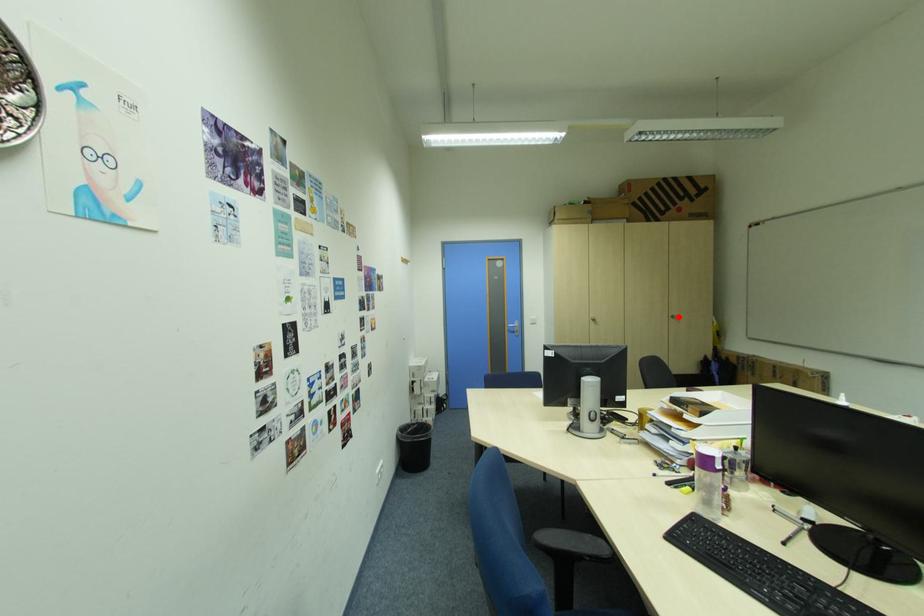
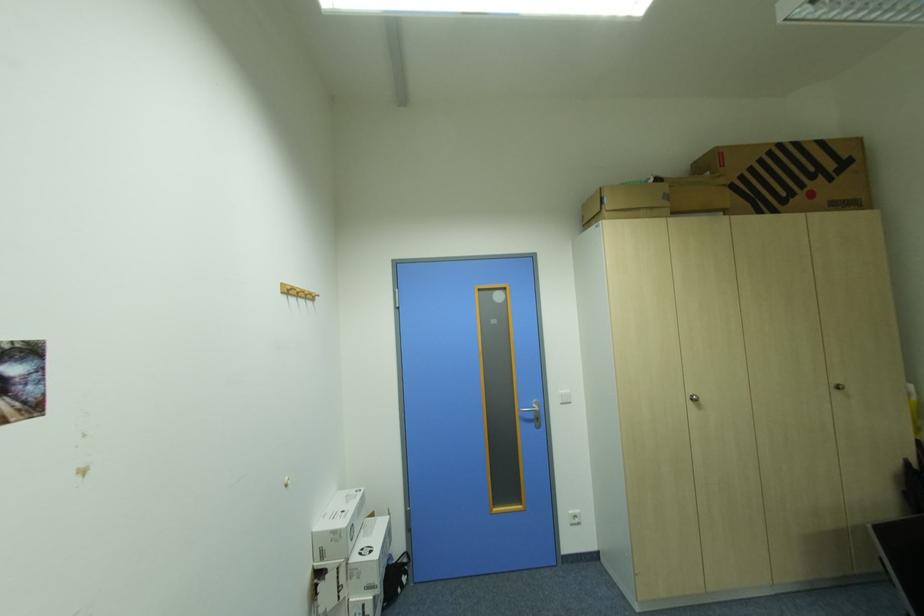
Question: I am providing you with two images of the same scene from different viewpoints. Given a red point in image1, look at the same physical point in image2. Is it:

Choices:
 (A) Closer to the viewpoint
 (B) Farther from the viewpoint

Answer: (A)